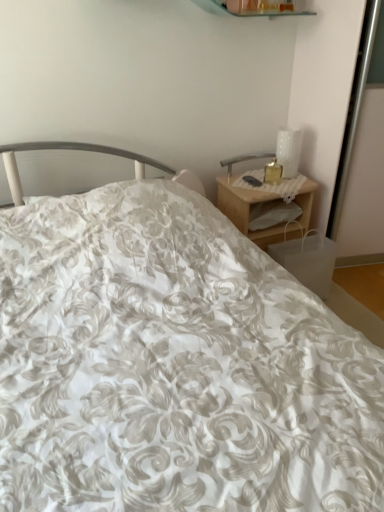
Find the location of a particular element. The height and width of the screenshot is (512, 384). vacant area that lies to the right of translucent glass candle at upper right is located at coordinates point(291,179).